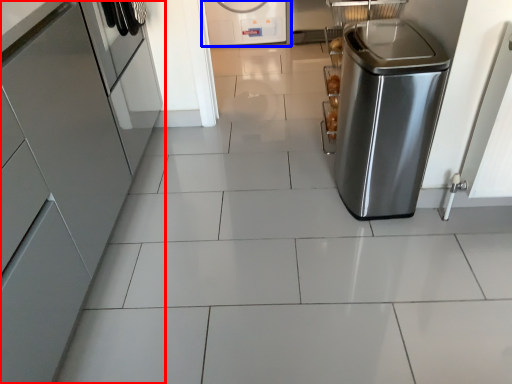
Question: Among these objects, which one is nearest to the camera, home appliance (highlighted by a red box) or home appliance (highlighted by a blue box)?

Choices:
 (A) home appliance
 (B) home appliance

Answer: (A)